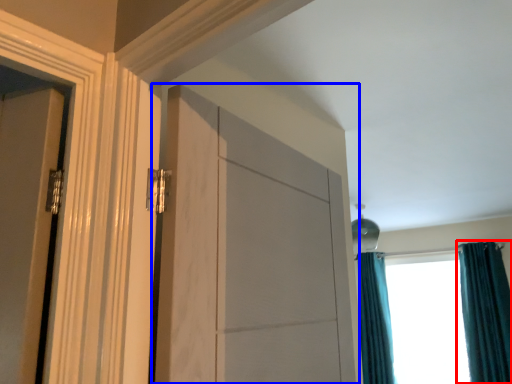
Question: Which of the following is the closest to the observer, curtain (highlighted by a red box) or door (highlighted by a blue box)?

Choices:
 (A) curtain
 (B) door

Answer: (B)